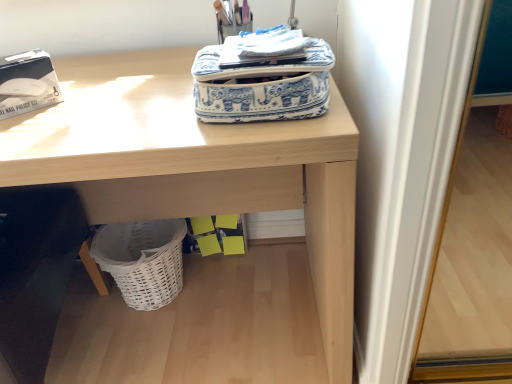
The image size is (512, 384). In order to click on vacant space to the left of blue and white fabric bag at upper center in this screenshot , I will do `click(137, 108)`.